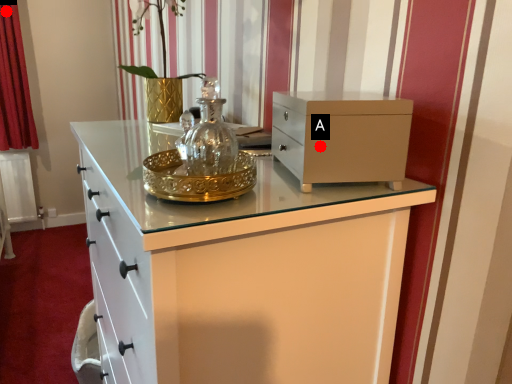
Question: Two points are circled on the image, labeled by A and B beside each circle. Among these points, which one is nearest to the camera?

Choices:
 (A) A is closer
 (B) B is closer

Answer: (A)